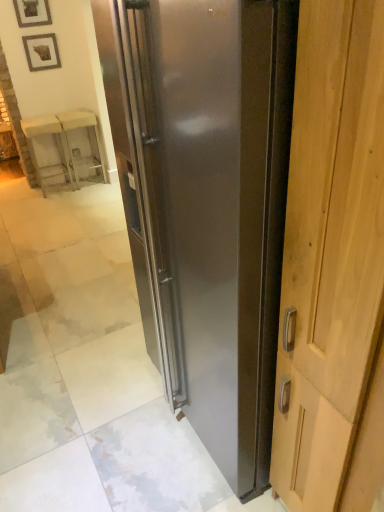
Find the location of a particular element. This screenshot has width=384, height=512. stainless steel refrigerator at center is located at coordinates (206, 203).

You are a GUI agent. You are given a task and a screenshot of the screen. Output one action in this format:
    pyautogui.click(x=<x>, y=<y>)
    Task: Click on the wooden picture frame at upper left, arranged as the first picture frame when ordered from the bottom
    This screenshot has width=384, height=512.
    Given the screenshot: What is the action you would take?
    pyautogui.click(x=41, y=52)

Is translucent glass cabinet at upper left, the 1th furniture when ordered from right to left, not close to stainless steel refrigerator at center?

That's right, there is a large distance between translucent glass cabinet at upper left, the 1th furniture when ordered from right to left, and stainless steel refrigerator at center.

From the image's perspective, is translucent glass cabinet at upper left, the 2th furniture viewed from the left, located above or below stainless steel refrigerator at center?

Based on their image positions, translucent glass cabinet at upper left, the 2th furniture viewed from the left, is located above stainless steel refrigerator at center.

Locate an element on the screen. The image size is (384, 512). refrigerator that appears above the translucent glass cabinet at upper left, the 1th furniture when ordered from right to left (from a real-world perspective) is located at coordinates (206, 203).

Does translucent glass cabinet at upper left, the 2th furniture viewed from the left, turn towards stainless steel refrigerator at center?

Yes, translucent glass cabinet at upper left, the 2th furniture viewed from the left, is oriented towards stainless steel refrigerator at center.

Is translucent glass cabinet at upper left, the 1th furniture when ordered from right to left, further to camera compared to wooden framed picture at upper left, the 2th picture frame ordered from the bottom?

Yes, it is.

Is translucent glass cabinet at upper left, the 2th furniture viewed from the left, in contact with wooden framed picture at upper left, the 2th picture frame ordered from the bottom?

There is a gap between translucent glass cabinet at upper left, the 2th furniture viewed from the left, and wooden framed picture at upper left, the 2th picture frame ordered from the bottom.

How different are the orientations of translucent glass cabinet at upper left, the 1th furniture when ordered from right to left, and wooden framed picture at upper left, the 2th picture frame ordered from the bottom, in degrees?

0.00626 degrees.

You are a GUI agent. You are given a task and a screenshot of the screen. Output one action in this format:
    pyautogui.click(x=<x>, y=<y>)
    Task: Click on the 2nd picture frame in front of the translucent glass cabinet at upper left, the 1th furniture when ordered from right to left
    This screenshot has height=512, width=384.
    Given the screenshot: What is the action you would take?
    click(x=32, y=12)

Which is more distant, (18, 18) or (272, 19)?

Positioned behind is point (18, 18).

Which is more to the right, wooden framed picture at upper left, the 2th picture frame ordered from the bottom, or stainless steel refrigerator at center?

stainless steel refrigerator at center is more to the right.

Is wooden framed picture at upper left, the 2th picture frame ordered from the bottom, wider or thinner than stainless steel refrigerator at center?

Considering their sizes, wooden framed picture at upper left, the 2th picture frame ordered from the bottom, looks slimmer than stainless steel refrigerator at center.

Could stainless steel refrigerator at center be considered to be inside wooden framed picture at upper left, the 2th picture frame ordered from the bottom?

Definitely not — stainless steel refrigerator at center is not inside wooden framed picture at upper left, the 2th picture frame ordered from the bottom.

Is wooden picture frame at upper left, arranged as the first picture frame when ordered from the bottom, taller than wooden framed picture at upper left, the 2th picture frame ordered from the bottom?

Indeed, wooden picture frame at upper left, arranged as the first picture frame when ordered from the bottom, has a greater height compared to wooden framed picture at upper left, the 2th picture frame ordered from the bottom.

Considering the sizes of objects wooden picture frame at upper left, arranged as the first picture frame when ordered from the bottom, and wooden framed picture at upper left, which appears as the first picture frame when viewed from the top, in the image provided, who is bigger, wooden picture frame at upper left, arranged as the first picture frame when ordered from the bottom, or wooden framed picture at upper left, which appears as the first picture frame when viewed from the top,?

With larger size is wooden picture frame at upper left, arranged as the first picture frame when ordered from the bottom.

Which point is more forward, (26,40) or (26,26)?

The point (26,26) is closer.

In terms of width, does wooden picture frame at upper left, positioned as the 2th picture frame in top-to-bottom order, look wider or thinner when compared to wooden framed picture at upper left, the 2th picture frame ordered from the bottom?

Considering their sizes, wooden picture frame at upper left, positioned as the 2th picture frame in top-to-bottom order, looks broader than wooden framed picture at upper left, the 2th picture frame ordered from the bottom.

Does stainless steel refrigerator at center have a lesser width compared to wooden framed picture at upper left, the 2th picture frame ordered from the bottom?

No, stainless steel refrigerator at center is not thinner than wooden framed picture at upper left, the 2th picture frame ordered from the bottom.

Which is behind, point (212, 241) or point (35, 20)?

The point (35, 20) is farther.

Between stainless steel refrigerator at center and wooden framed picture at upper left, the 2th picture frame ordered from the bottom, which one is positioned in front?

stainless steel refrigerator at center is more forward.

Is stainless steel refrigerator at center oriented towards wooden framed picture at upper left, which appears as the first picture frame when viewed from the top?

No, stainless steel refrigerator at center is not oriented towards wooden framed picture at upper left, which appears as the first picture frame when viewed from the top.

Are stainless steel refrigerator at center and wooden chair at left, which is the 1th furniture from left to right, far apart?

stainless steel refrigerator at center is positioned a significant distance from wooden chair at left, which is the 1th furniture from left to right.

From the image's perspective, which one is positioned higher, stainless steel refrigerator at center or wooden chair at left, the second furniture viewed from the right?

wooden chair at left, the second furniture viewed from the right, appears higher in the image.

Is wooden chair at left, which is the 1th furniture from left to right, at the back of stainless steel refrigerator at center?

No, wooden chair at left, which is the 1th furniture from left to right, is not at the back of stainless steel refrigerator at center.

Can you confirm if stainless steel refrigerator at center is wider than wooden chair at left, which is the 1th furniture from left to right?

Indeed, stainless steel refrigerator at center has a greater width compared to wooden chair at left, which is the 1th furniture from left to right.

From the picture: From their relative heights in the image, would you say translucent glass cabinet at upper left, the 2th furniture viewed from the left, is taller or shorter than wooden chair at left, which is the 1th furniture from left to right?

Considering their sizes, translucent glass cabinet at upper left, the 2th furniture viewed from the left, has more height than wooden chair at left, which is the 1th furniture from left to right.

From a real-world perspective, is translucent glass cabinet at upper left, the 2th furniture viewed from the left, physically above wooden chair at left, the second furniture viewed from the right?

Correct, in the physical world, translucent glass cabinet at upper left, the 2th furniture viewed from the left, is higher than wooden chair at left, the second furniture viewed from the right.

Which is in front, translucent glass cabinet at upper left, the 1th furniture when ordered from right to left, or wooden chair at left, which is the 1th furniture from left to right?

wooden chair at left, which is the 1th furniture from left to right, is closer to the camera.

The image size is (384, 512). I want to click on the 2nd furniture above when counting from the stainless steel refrigerator at center (from the image's perspective), so click(x=89, y=137).

You are a GUI agent. You are given a task and a screenshot of the screen. Output one action in this format:
    pyautogui.click(x=<x>, y=<y>)
    Task: Click on the 2nd picture frame in front of the translucent glass cabinet at upper left, the 1th furniture when ordered from right to left
    
    Given the screenshot: What is the action you would take?
    pyautogui.click(x=32, y=12)

From the image, which object appears to be farther from wooden picture frame at upper left, positioned as the 2th picture frame in top-to-bottom order, wooden framed picture at upper left, the 2th picture frame ordered from the bottom, or stainless steel refrigerator at center?

The object further to wooden picture frame at upper left, positioned as the 2th picture frame in top-to-bottom order, is stainless steel refrigerator at center.

From the image, which object appears to be nearer to wooden picture frame at upper left, arranged as the first picture frame when ordered from the bottom, stainless steel refrigerator at center or wooden chair at left, which is the 1th furniture from left to right?

Among the two, wooden chair at left, which is the 1th furniture from left to right, is located nearer to wooden picture frame at upper left, arranged as the first picture frame when ordered from the bottom.

Estimate the real-world distances between objects in this image. Which object is further from wooden picture frame at upper left, positioned as the 2th picture frame in top-to-bottom order, stainless steel refrigerator at center or wooden framed picture at upper left, the 2th picture frame ordered from the bottom?

Among the two, stainless steel refrigerator at center is located further to wooden picture frame at upper left, positioned as the 2th picture frame in top-to-bottom order.

From the picture: Looking at the image, which one is located closer to translucent glass cabinet at upper left, the 2th furniture viewed from the left, wooden chair at left, which is the 1th furniture from left to right, or stainless steel refrigerator at center?

wooden chair at left, which is the 1th furniture from left to right, is closer to translucent glass cabinet at upper left, the 2th furniture viewed from the left.

Based on their spatial positions, is wooden picture frame at upper left, arranged as the first picture frame when ordered from the bottom, or stainless steel refrigerator at center closer to translucent glass cabinet at upper left, the 1th furniture when ordered from right to left?

wooden picture frame at upper left, arranged as the first picture frame when ordered from the bottom.

Based on their spatial positions, is wooden picture frame at upper left, positioned as the 2th picture frame in top-to-bottom order, or wooden framed picture at upper left, the 2th picture frame ordered from the bottom, closer to translucent glass cabinet at upper left, the 2th furniture viewed from the left?

wooden picture frame at upper left, positioned as the 2th picture frame in top-to-bottom order, is closer to translucent glass cabinet at upper left, the 2th furniture viewed from the left.

Considering their positions, is wooden framed picture at upper left, which appears as the first picture frame when viewed from the top, positioned closer to translucent glass cabinet at upper left, the 1th furniture when ordered from right to left, than wooden chair at left, the second furniture viewed from the right?

Based on the image, wooden chair at left, the second furniture viewed from the right, appears to be nearer to translucent glass cabinet at upper left, the 1th furniture when ordered from right to left.

From the image, which object appears to be nearer to stainless steel refrigerator at center, translucent glass cabinet at upper left, the 1th furniture when ordered from right to left, or wooden chair at left, which is the 1th furniture from left to right?

wooden chair at left, which is the 1th furniture from left to right.

You are a GUI agent. You are given a task and a screenshot of the screen. Output one action in this format:
    pyautogui.click(x=<x>, y=<y>)
    Task: Click on the furniture between wooden framed picture at upper left, which appears as the first picture frame when viewed from the top, and wooden chair at left, the second furniture viewed from the right, vertically
    This screenshot has height=512, width=384.
    Given the screenshot: What is the action you would take?
    pyautogui.click(x=89, y=137)

Locate an element on the screen. This screenshot has height=512, width=384. picture frame between stainless steel refrigerator at center and wooden picture frame at upper left, positioned as the 2th picture frame in top-to-bottom order, along the z-axis is located at coordinates (32, 12).

This screenshot has width=384, height=512. Identify the location of picture frame between wooden framed picture at upper left, which appears as the first picture frame when viewed from the top, and wooden chair at left, the second furniture viewed from the right, in the vertical direction. (41, 52).

Find the location of `furniture between stainless steel refrigerator at center and translucent glass cabinet at upper left, the 1th furniture when ordered from right to left, from front to back`. furniture between stainless steel refrigerator at center and translucent glass cabinet at upper left, the 1th furniture when ordered from right to left, from front to back is located at coordinates (56, 145).